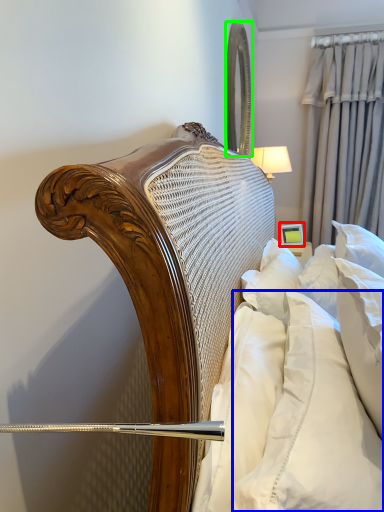
Question: Considering the real-world distances, which object is closest to picture frame (highlighted by a red box)? pillow (highlighted by a blue box) or mirror (highlighted by a green box).

Choices:
 (A) pillow
 (B) mirror

Answer: (B)